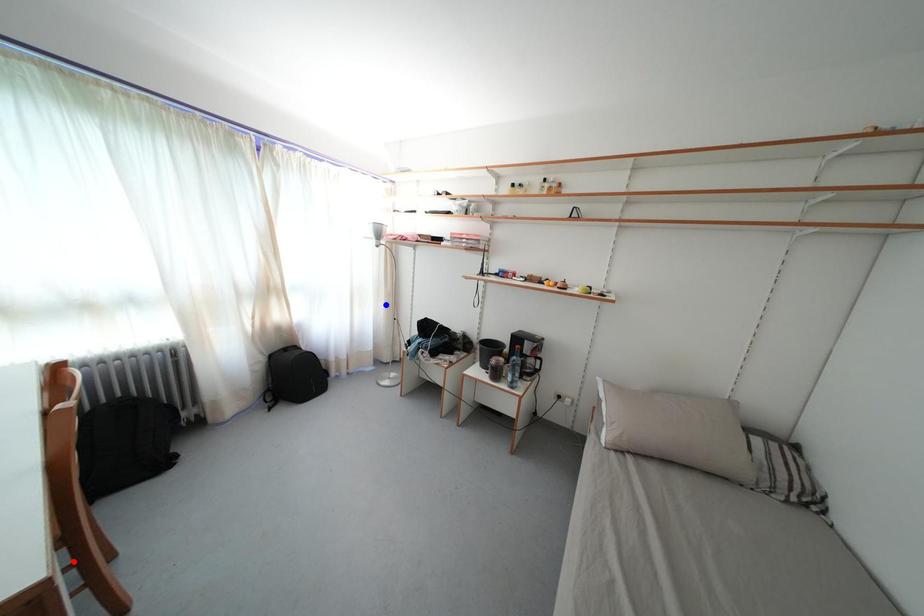
Question: Which of the two points in the image is closer to the camera?

Choices:
 (A) Blue point is closer.
 (B) Red point is closer.

Answer: (B)